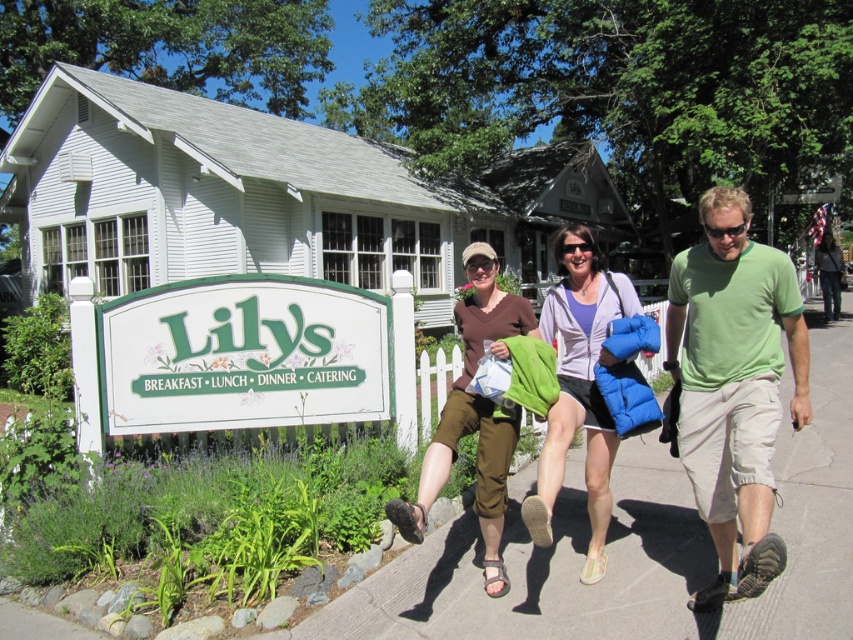
Measure the distance from green cotton shorts at center to light purple fleece jacket at center.

green cotton shorts at center is 23.06 inches from light purple fleece jacket at center.

Can you confirm if green cotton shorts at center is positioned above light purple fleece jacket at center?

Yes.

The height and width of the screenshot is (640, 853). I want to click on green cotton shorts at center, so click(733, 387).

Locate an element on the screen. The width and height of the screenshot is (853, 640). green cotton shorts at center is located at coordinates (733, 387).

Can you confirm if brown cotton shirt at center is bigger than denim jacket at center?

Yes.

Who is more forward, [479,284] or [828,317]?

Positioned in front is point [479,284].

At what (x,y) coordinates should I click in order to perform the action: click on brown cotton shirt at center. Please return your answer as a coordinate pair (x, y). The height and width of the screenshot is (640, 853). Looking at the image, I should click on (474, 417).

Does light purple fleece jacket at center appear under brown cotton shirt at center?

No.

Can you confirm if light purple fleece jacket at center is smaller than brown cotton shirt at center?

Correct, light purple fleece jacket at center occupies less space than brown cotton shirt at center.

Between point (543, 486) and point (485, 330), which one is positioned in front?

Point (543, 486) is more forward.

Where is `light purple fleece jacket at center`? Image resolution: width=853 pixels, height=640 pixels. light purple fleece jacket at center is located at coordinates (579, 388).